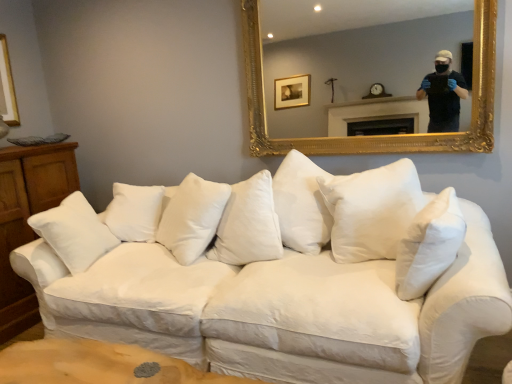
Question: From a real-world perspective, is wooden dresser at left under gold ornate mirror at upper center?

Choices:
 (A) no
 (B) yes

Answer: (B)

Question: Can you confirm if wooden dresser at left is wider than gold ornate mirror at upper center?

Choices:
 (A) yes
 (B) no

Answer: (A)

Question: Could gold ornate mirror at upper center be considered to be inside wooden dresser at left?

Choices:
 (A) no
 (B) yes

Answer: (A)

Question: From the image's perspective, is wooden dresser at left below gold ornate mirror at upper center?

Choices:
 (A) no
 (B) yes

Answer: (B)

Question: Is wooden dresser at left aimed at gold ornate mirror at upper center?

Choices:
 (A) yes
 (B) no

Answer: (A)

Question: Is gold ornate mirror at upper center in front of or behind wooden dresser at left in the image?

Choices:
 (A) behind
 (B) front

Answer: (B)

Question: Looking at the image, does gold ornate mirror at upper center seem bigger or smaller compared to wooden dresser at left?

Choices:
 (A) small
 (B) big

Answer: (A)

Question: Considering the positions of point (433, 36) and point (58, 180), is point (433, 36) closer or farther from the camera than point (58, 180)?

Choices:
 (A) closer
 (B) farther

Answer: (B)

Question: Is gold ornate mirror at upper center taller or shorter than wooden dresser at left?

Choices:
 (A) tall
 (B) short

Answer: (B)

Question: Is white cotton pillow at center, acting as the second pillow starting from the front, to the left or to the right of white cotton couch at center in the image?

Choices:
 (A) right
 (B) left

Answer: (B)

Question: Considering the positions of white cotton pillow at center, the 1th pillow positioned from the back, and white cotton couch at center in the image, is white cotton pillow at center, the 1th pillow positioned from the back, wider or thinner than white cotton couch at center?

Choices:
 (A) thin
 (B) wide

Answer: (A)

Question: Is white cotton pillow at center, the 1th pillow positioned from the back, inside the boundaries of white cotton couch at center, or outside?

Choices:
 (A) inside
 (B) outside

Answer: (A)

Question: Is point (178, 231) closer or farther from the camera than point (89, 288)?

Choices:
 (A) farther
 (B) closer

Answer: (A)

Question: From the image's perspective, is white soft pillow at center, which appears as the first pillow when viewed from the right, located above or below wooden dresser at left?

Choices:
 (A) below
 (B) above

Answer: (B)

Question: Is white soft pillow at center, which appears as the first pillow when viewed from the right, wider or thinner than wooden dresser at left?

Choices:
 (A) thin
 (B) wide

Answer: (A)